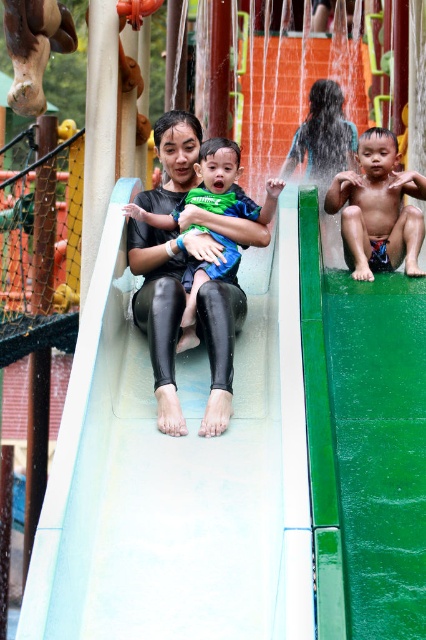
Does white smooth slide at center have a greater height compared to skinny boy at center?

Yes, white smooth slide at center is taller than skinny boy at center.

Can you confirm if white smooth slide at center is positioned above skinny boy at center?

No.

Identify the location of white smooth slide at center. The image size is (426, 640). (154, 481).

Can you confirm if white smooth slide at center is positioned above matte black wetsuit at center?

No, white smooth slide at center is not above matte black wetsuit at center.

Is point (118, 589) less distant than point (333, 220)?

Yes, it is in front of point (333, 220).

I want to click on white smooth slide at center, so click(x=154, y=481).

Is white smooth slide at center to the right of matte black swimwear at left from the viewer's perspective?

No, white smooth slide at center is not to the right of matte black swimwear at left.

Does point (109, 536) come behind point (207, 189)?

No, it is in front of (207, 189).

The image size is (426, 640). Identify the location of white smooth slide at center. (154, 481).